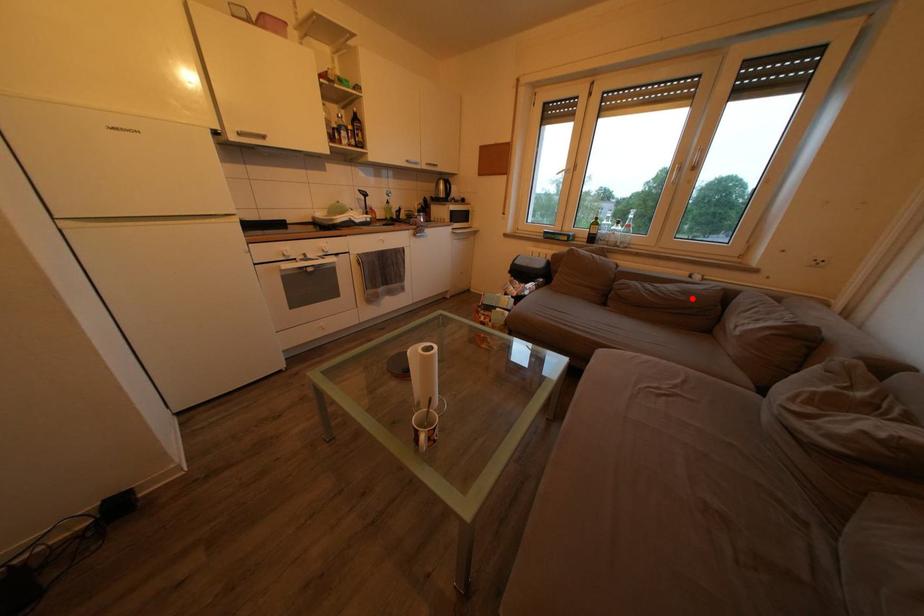
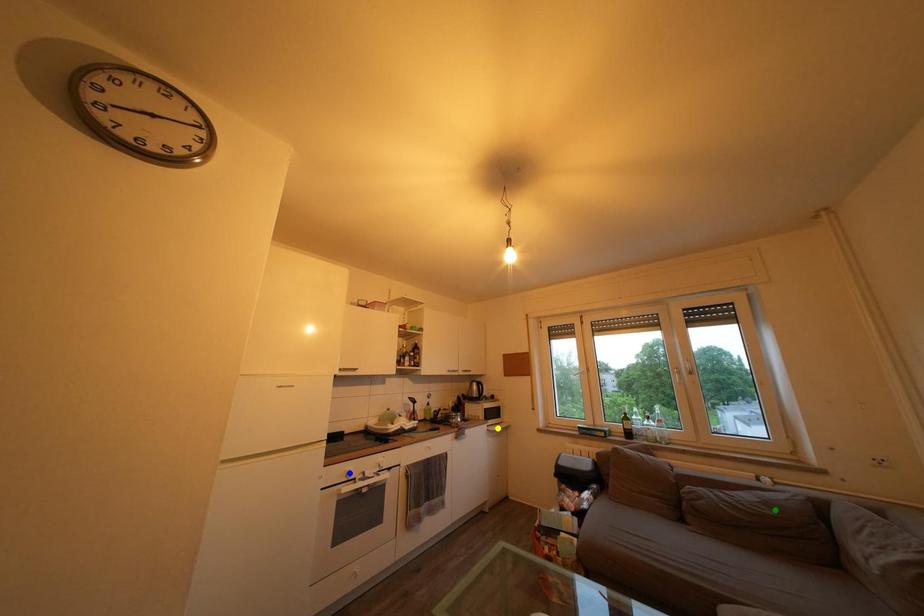
Question: I am providing you with two images of the same scene from different viewpoints. A red point is marked on the first image. You are given multiple points on the second image. Which point in image 2 represents the same 3d spot as the red point in image 1?

Choices:
 (A) blue point
 (B) yellow point
 (C) green point

Answer: (C)